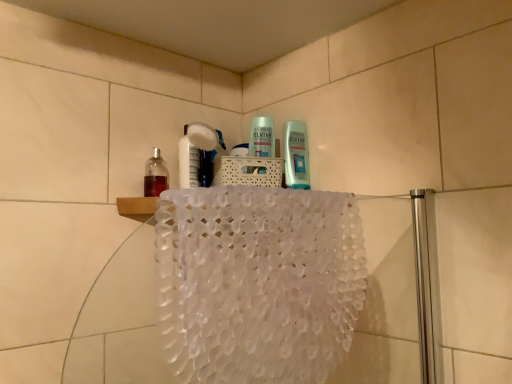
The width and height of the screenshot is (512, 384). What do you see at coordinates (155, 175) in the screenshot?
I see `translucent plastic bottle at upper left` at bounding box center [155, 175].

Locate an element on the screen. The width and height of the screenshot is (512, 384). translucent plastic bottle at upper left is located at coordinates (155, 175).

I want to click on translucent plastic bath towel at upper center, so click(258, 283).

What do you see at coordinates (258, 283) in the screenshot?
I see `translucent plastic bath towel at upper center` at bounding box center [258, 283].

This screenshot has width=512, height=384. In order to click on translucent plastic bottle at upper left in this screenshot , I will do `click(155, 175)`.

Is translucent plastic bottle at upper left at the left side of translucent plastic bath towel at upper center?

Indeed, translucent plastic bottle at upper left is positioned on the left side of translucent plastic bath towel at upper center.

Consider the image. In the image, is translucent plastic bottle at upper left positioned in front of or behind translucent plastic bath towel at upper center?

translucent plastic bottle at upper left is positioned farther from the viewer than translucent plastic bath towel at upper center.

Is point (163, 163) closer to camera compared to point (236, 351)?

No, it is behind (236, 351).

From the image's perspective, relative to translucent plastic bath towel at upper center, is translucent plastic bottle at upper left above or below?

translucent plastic bottle at upper left is situated higher than translucent plastic bath towel at upper center in the image.

From a real-world perspective, is translucent plastic bottle at upper left on translucent plastic bath towel at upper center?

Yes, from a real-world perspective, translucent plastic bottle at upper left is above translucent plastic bath towel at upper center.

In terms of width, does translucent plastic bottle at upper left look wider or thinner when compared to translucent plastic bath towel at upper center?

translucent plastic bottle at upper left is thinner than translucent plastic bath towel at upper center.

From their relative heights in the image, would you say translucent plastic bottle at upper left is taller or shorter than translucent plastic bath towel at upper center?

→ Clearly, translucent plastic bottle at upper left is shorter compared to translucent plastic bath towel at upper center.

Consider the image. Who is smaller, translucent plastic bottle at upper left or translucent plastic bath towel at upper center?

Smaller between the two is translucent plastic bottle at upper left.

Consider the image. Is translucent plastic bottle at upper left completely or partially outside of translucent plastic bath towel at upper center?

Yes.

Is translucent plastic bottle at upper left directly adjacent to translucent plastic bath towel at upper center?

No, translucent plastic bottle at upper left is not making contact with translucent plastic bath towel at upper center.

Is translucent plastic bottle at upper left aimed at translucent plastic bath towel at upper center?

No, translucent plastic bottle at upper left is not aimed at translucent plastic bath towel at upper center.

Locate an element on the screen. bottle behind the translucent plastic bath towel at upper center is located at coordinates (155, 175).

Considering the relative positions of translucent plastic bath towel at upper center and translucent plastic bottle at upper left in the image provided, is translucent plastic bath towel at upper center to the left of translucent plastic bottle at upper left from the viewer's perspective?

In fact, translucent plastic bath towel at upper center is to the right of translucent plastic bottle at upper left.

In the image, is translucent plastic bath towel at upper center positioned in front of or behind translucent plastic bottle at upper left?

Visually, translucent plastic bath towel at upper center is located in front of translucent plastic bottle at upper left.

Is point (193, 298) farther from viewer compared to point (157, 172)?

No.

From the image's perspective, would you say translucent plastic bath towel at upper center is shown under translucent plastic bottle at upper left?

Yes.

From a real-world perspective, is translucent plastic bath towel at upper center located higher than translucent plastic bottle at upper left?

Incorrect, from a real-world perspective, translucent plastic bath towel at upper center is lower than translucent plastic bottle at upper left.

Does translucent plastic bath towel at upper center have a greater width compared to translucent plastic bottle at upper left?

Yes, translucent plastic bath towel at upper center is wider than translucent plastic bottle at upper left.

Which of these two, translucent plastic bath towel at upper center or translucent plastic bottle at upper left, stands shorter?

translucent plastic bottle at upper left.

Considering the sizes of translucent plastic bath towel at upper center and translucent plastic bottle at upper left in the image, is translucent plastic bath towel at upper center bigger or smaller than translucent plastic bottle at upper left?

In the image, translucent plastic bath towel at upper center appears to be larger than translucent plastic bottle at upper left.

Is translucent plastic bath towel at upper center inside or outside of translucent plastic bottle at upper left?

translucent plastic bath towel at upper center cannot be found inside translucent plastic bottle at upper left.

Is translucent plastic bath towel at upper center not near translucent plastic bottle at upper left?

That's not correct — translucent plastic bath towel at upper center is a little close to translucent plastic bottle at upper left.

Is translucent plastic bottle at upper left at the back of translucent plastic bath towel at upper center?

Yes, translucent plastic bottle at upper left is at the back of translucent plastic bath towel at upper center.

Can you tell me how much translucent plastic bath towel at upper center and translucent plastic bottle at upper left differ in facing direction?

There is a 41.5-degree angle between the facing directions of translucent plastic bath towel at upper center and translucent plastic bottle at upper left.

I want to click on bottle behind the translucent plastic bath towel at upper center, so click(x=155, y=175).

This screenshot has height=384, width=512. In order to click on bath towel located below the translucent plastic bottle at upper left (from the image's perspective) in this screenshot , I will do `click(258, 283)`.

Locate an element on the screen. The height and width of the screenshot is (384, 512). bath towel in front of the translucent plastic bottle at upper left is located at coordinates (258, 283).